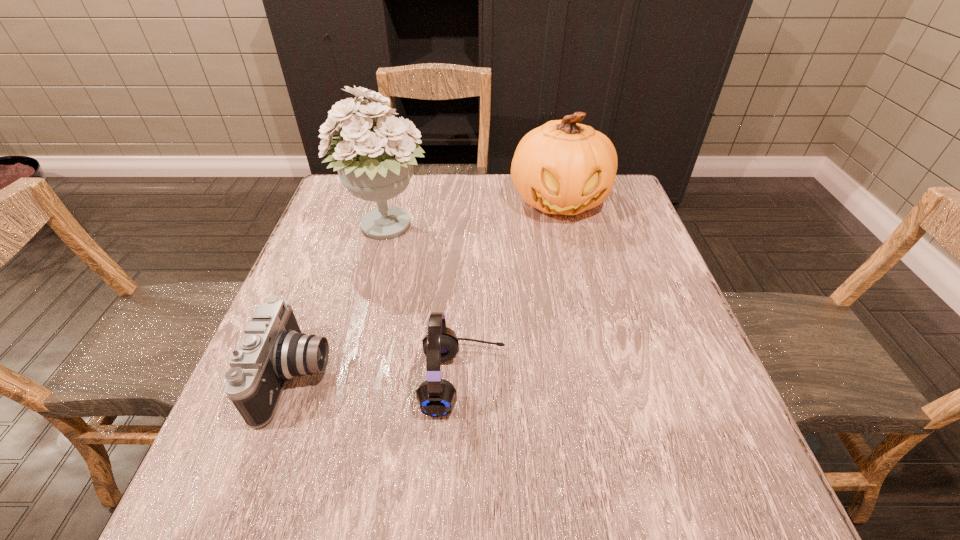
Locate an element on the screen. The height and width of the screenshot is (540, 960). pumpkin located in the far edge section of the desktop is located at coordinates (562, 167).

I want to click on bouquet located at the left edge, so click(x=376, y=165).

This screenshot has width=960, height=540. In order to click on camera at the left edge in this screenshot , I will do pyautogui.click(x=273, y=350).

You are a GUI agent. You are given a task and a screenshot of the screen. Output one action in this format:
    pyautogui.click(x=<x>, y=<y>)
    Task: Click on the object positioned at the right edge
    
    Given the screenshot: What is the action you would take?
    pyautogui.click(x=562, y=167)

Where is `object that is at the far left corner`? This screenshot has height=540, width=960. object that is at the far left corner is located at coordinates (376, 165).

This screenshot has height=540, width=960. In order to click on object that is at the far right corner in this screenshot , I will do `click(562, 167)`.

Locate an element on the screen. This screenshot has height=540, width=960. vacant space at the far edge of the desktop is located at coordinates (424, 181).

In order to click on free region at the near edge of the desktop in this screenshot , I will do `click(548, 506)`.

The height and width of the screenshot is (540, 960). I want to click on vacant area at the left edge of the desktop, so click(x=330, y=370).

In the image, there is a desktop. What are the coordinates of `vacant space at the right edge` in the screenshot? It's located at (636, 221).